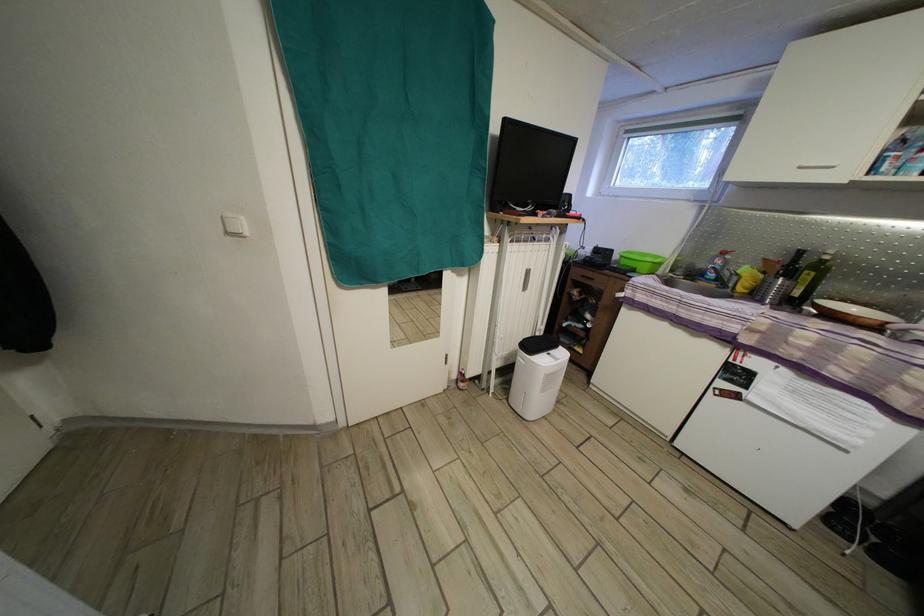
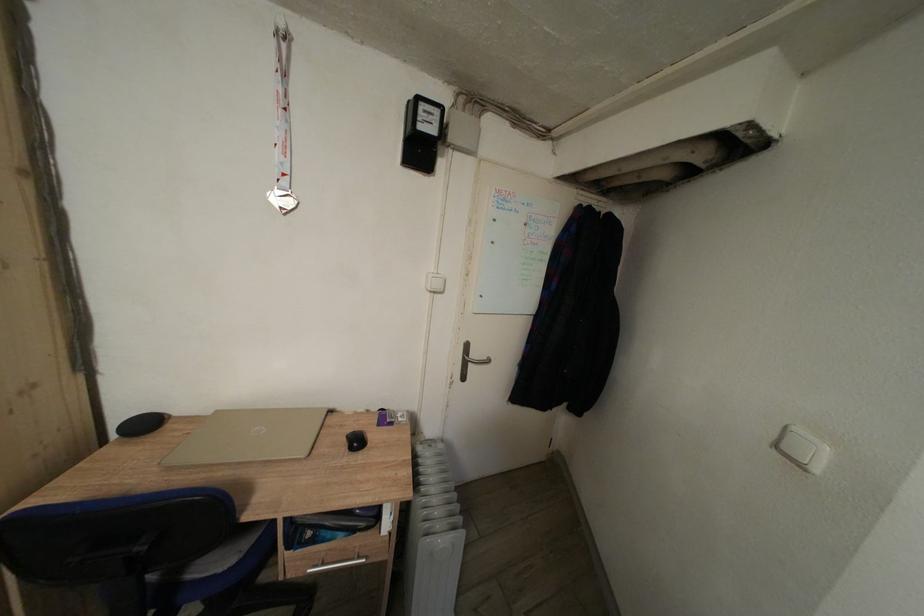
Question: The first image is from the beginning of the video and the second image is from the end. How did the camera likely rotate when shooting the video?

Choices:
 (A) Left
 (B) Right
 (C) Up
 (D) Down

Answer: (A)